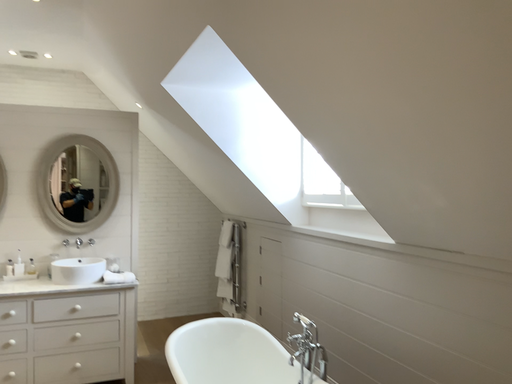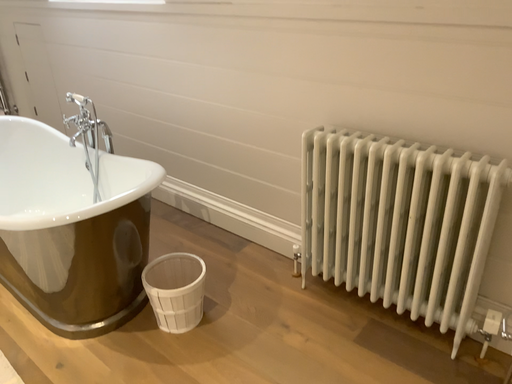
Question: Which way did the camera rotate in the video?

Choices:
 (A) rotated downward
 (B) rotated upward

Answer: (A)